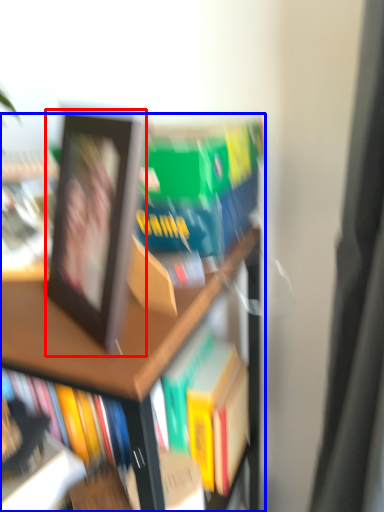
Question: Which point is further to the camera, picture frame (highlighted by a red box) or bookcase (highlighted by a blue box)?

Choices:
 (A) picture frame
 (B) bookcase

Answer: (B)